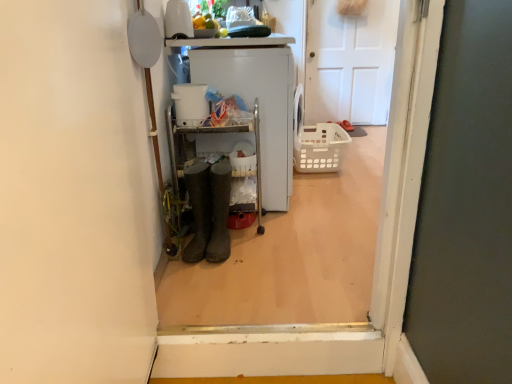
Locate an element on the screen. The width and height of the screenshot is (512, 384). vacant area that lies to the right of brown leather boots at center, the 2th footwear when ordered from right to left is located at coordinates (249, 253).